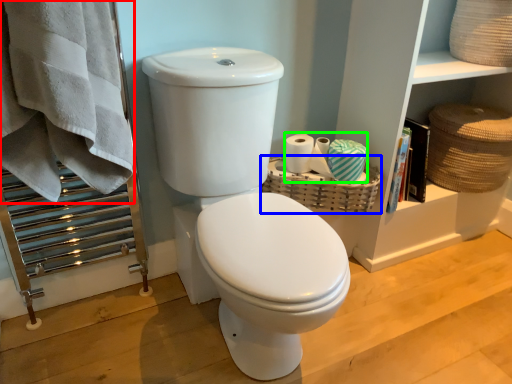
Question: Based on their relative distances, which object is nearer to bath towel (highlighted by a red box)? Choose from basket (highlighted by a blue box) and toilet paper (highlighted by a green box).

Choices:
 (A) basket
 (B) toilet paper

Answer: (A)